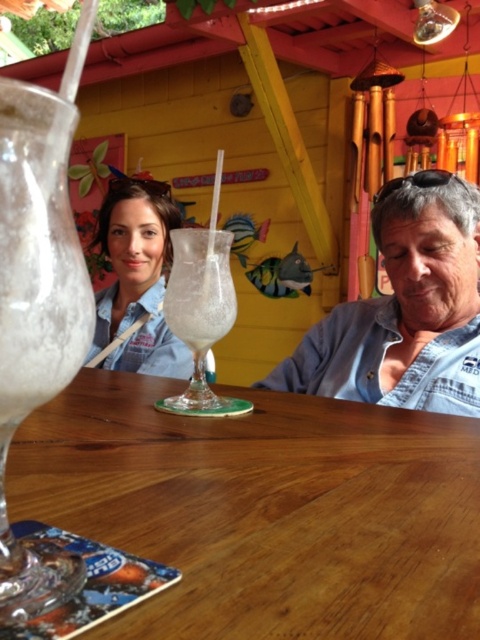
You are a customer at this outdoor bar and want to place your phone on the wooden table at center and the white frosted glass at center. Which object should you place it on to keep it away from the beverages?

The wooden table at center is positioned on the right side of the white frosted glass at center, so placing the phone on the wooden table at center would keep it away from the beverages.

You are a customer at this outdoor bar and want to place your phone on the wooden table at center. However, you notice the matte blue shirt at upper left nearby. Considering their sizes, will the phone fit on the table without falling off?

The wooden table at center is smaller than the matte blue shirt at upper left. Since the table is smaller, it might not have enough space for the phone, so there is a risk of it falling off unless placed carefully.

Consider the image. You are a waiter at a beachside restaurant and you see a customer approaching the wooden table at center and the matte blue shirt at upper left. Which object should you approach first to greet the customer?

You should approach the wooden table at center first because it is positioned on the right side of the matte blue shirt at upper left, making it closer to the customer who is approaching from the left side.